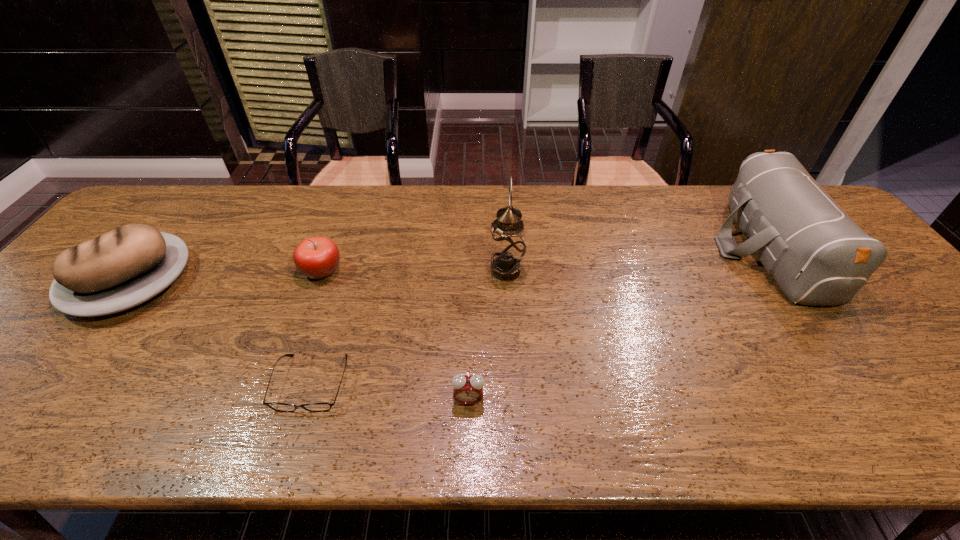
You are a GUI agent. You are given a task and a screenshot of the screen. Output one action in this format:
    pyautogui.click(x=<x>, y=<y>)
    Task: Click on the fifth object from left to right
    The width and height of the screenshot is (960, 540).
    Given the screenshot: What is the action you would take?
    pyautogui.click(x=507, y=243)

In order to click on oil lamp in this screenshot , I will do `click(507, 243)`.

Locate an element on the screen. This screenshot has height=540, width=960. the rightmost object is located at coordinates (817, 254).

At what (x,y) coordinates should I click in order to perform the action: click on the second tallest object. Please return your answer as a coordinate pair (x, y). Looking at the image, I should click on (817, 254).

Where is `bread`? bread is located at coordinates (127, 266).

This screenshot has width=960, height=540. I want to click on the third tallest object, so click(127, 266).

You are a GUI agent. You are given a task and a screenshot of the screen. Output one action in this format:
    pyautogui.click(x=<x>, y=<y>)
    Task: Click on the apple
    
    Given the screenshot: What is the action you would take?
    pyautogui.click(x=317, y=257)

I want to click on the third object from right to left, so click(467, 389).

This screenshot has height=540, width=960. Identify the location of the second shortest object. (467, 389).

In order to click on spectacles in this screenshot , I will do `click(283, 407)`.